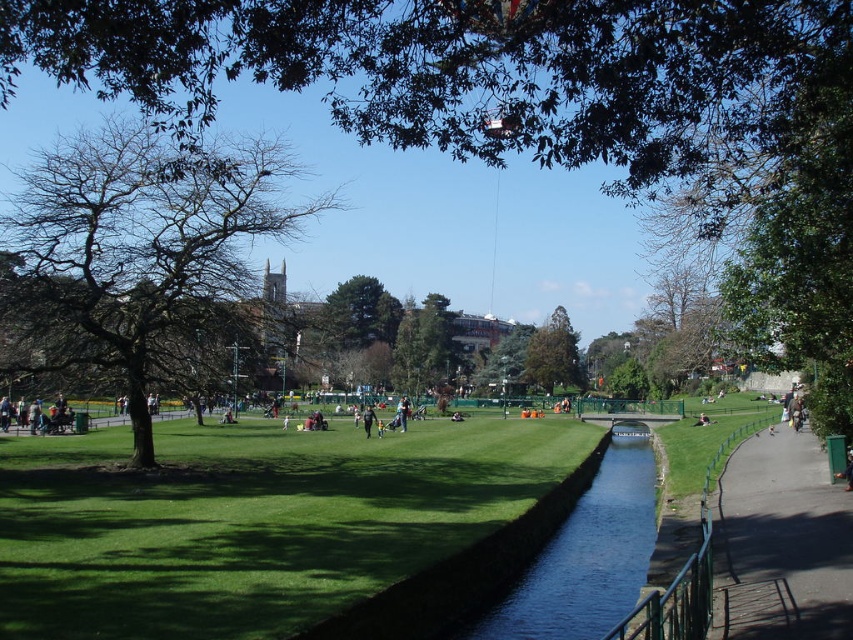
Which is in front, point (761, 598) or point (363, 413)?

Point (761, 598) is more forward.

Describe the element at coordinates (781, 544) in the screenshot. I see `green metal fence at lower right` at that location.

This screenshot has width=853, height=640. Identify the location of green metal fence at lower right. (781, 544).

Which is below, green leafy tree at center or light brown leather jacket at lower right?

light brown leather jacket at lower right is lower down.

Is point (579, 381) closer to viewer compared to point (700, 417)?

No.

Which is behind, point (563, 314) or point (701, 413)?

The point (563, 314) is behind.

You are a GUI agent. You are given a task and a screenshot of the screen. Output one action in this format:
    pyautogui.click(x=<x>, y=<y>)
    Task: Click on the green leafy tree at center
    
    Given the screenshot: What is the action you would take?
    pyautogui.click(x=552, y=353)

Is brown leafy tree at left thinner than light blue denim jeans at center?

Incorrect, brown leafy tree at left's width is not less than light blue denim jeans at center's.

Is brown leafy tree at left bigger than light blue denim jeans at center?

Correct, brown leafy tree at left is larger in size than light blue denim jeans at center.

This screenshot has width=853, height=640. Describe the element at coordinates (136, 257) in the screenshot. I see `brown leafy tree at left` at that location.

The image size is (853, 640). What are the coordinates of `brown leafy tree at left` in the screenshot? It's located at (136, 257).